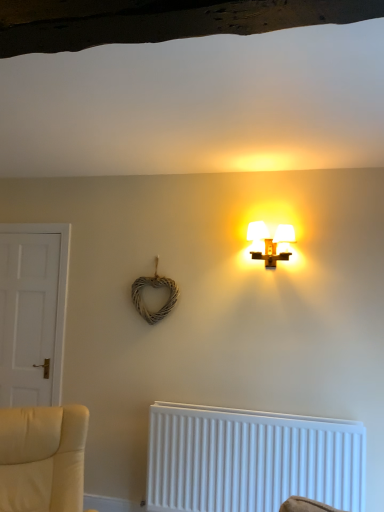
Question: Is white plastic radiator at lower center to the left of matte white lamp at upper center from the viewer's perspective?

Choices:
 (A) no
 (B) yes

Answer: (B)

Question: Is white plastic radiator at lower center next to matte white lamp at upper center and touching it?

Choices:
 (A) yes
 (B) no

Answer: (B)

Question: Is white plastic radiator at lower center completely or partially outside of matte white lamp at upper center?

Choices:
 (A) no
 (B) yes

Answer: (B)

Question: From a real-world perspective, is white plastic radiator at lower center below matte white lamp at upper center?

Choices:
 (A) yes
 (B) no

Answer: (A)

Question: From the image's perspective, is white plastic radiator at lower center beneath matte white lamp at upper center?

Choices:
 (A) no
 (B) yes

Answer: (B)

Question: Are white plastic radiator at lower center and matte white lamp at upper center far apart?

Choices:
 (A) yes
 (B) no

Answer: (A)

Question: Is the position of matte white lamp at upper center more distant than that of white matte door at left?

Choices:
 (A) yes
 (B) no

Answer: (B)

Question: Is matte white lamp at upper center beside white matte door at left?

Choices:
 (A) yes
 (B) no

Answer: (B)

Question: Does matte white lamp at upper center have a lesser width compared to white matte door at left?

Choices:
 (A) no
 (B) yes

Answer: (A)

Question: From the image's perspective, is matte white lamp at upper center under white matte door at left?

Choices:
 (A) yes
 (B) no

Answer: (B)

Question: Could you tell me if matte white lamp at upper center is turned towards white matte door at left?

Choices:
 (A) no
 (B) yes

Answer: (A)

Question: Does matte white lamp at upper center have a greater height compared to white matte door at left?

Choices:
 (A) no
 (B) yes

Answer: (A)

Question: Can you confirm if matte white lamp at upper center is positioned to the left of white plastic radiator at lower center?

Choices:
 (A) no
 (B) yes

Answer: (A)